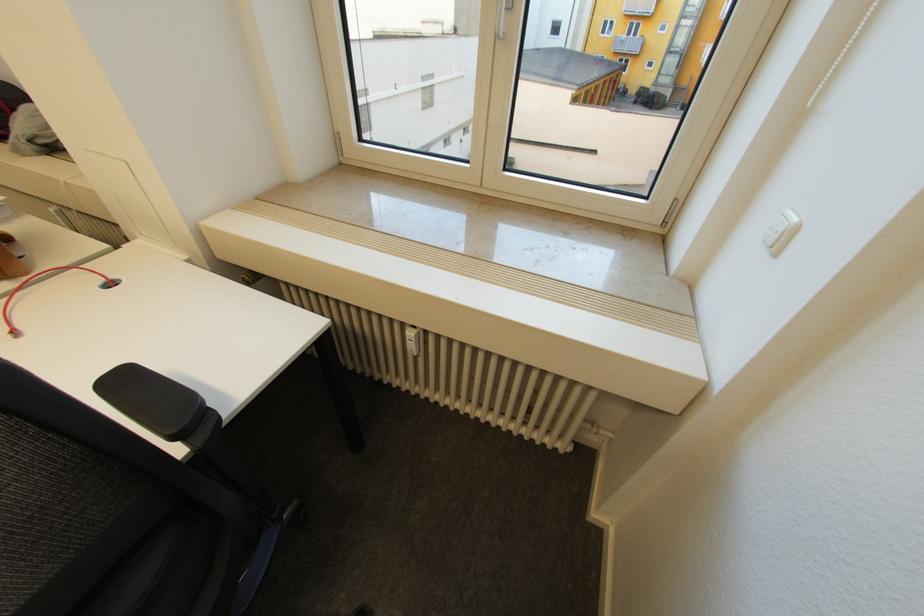
This screenshot has height=616, width=924. What do you see at coordinates (843, 53) in the screenshot?
I see `the window blind cord` at bounding box center [843, 53].